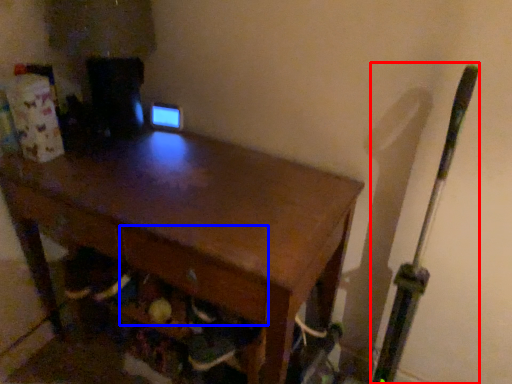
Question: Among these objects, which one is nearest to the camera, baseball bat (highlighted by a red box) or drawer (highlighted by a blue box)?

Choices:
 (A) baseball bat
 (B) drawer

Answer: (A)